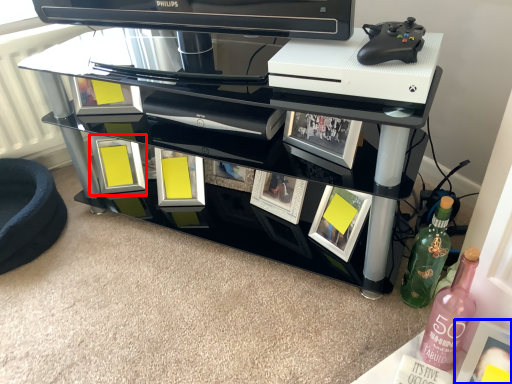
Question: Which object appears closest to the camera in this image, picture frame (highlighted by a red box) or picture frame (highlighted by a blue box)?

Choices:
 (A) picture frame
 (B) picture frame

Answer: (B)